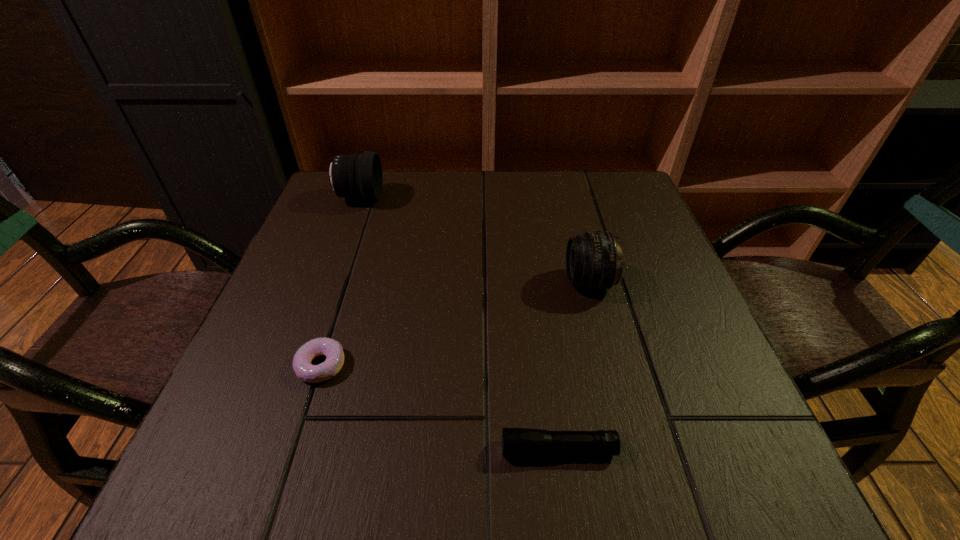
Where is `free region located at the front element of the right telephoto lens`? free region located at the front element of the right telephoto lens is located at coordinates (488, 282).

Locate an element on the screen. This screenshot has height=540, width=960. free spot located 0.090m at the front element of the right telephoto lens is located at coordinates click(x=522, y=282).

Locate an element on the screen. vacant space situated 0.090m at the lens end of the flashlight is located at coordinates (441, 449).

Where is `vacant space located 0.160m at the lens end of the flashlight`? vacant space located 0.160m at the lens end of the flashlight is located at coordinates (392, 449).

Locate an element on the screen. vacant position located 0.120m at the lens end of the flashlight is located at coordinates (420, 449).

You are a GUI agent. You are given a task and a screenshot of the screen. Output one action in this format:
    pyautogui.click(x=<x>, y=<y>)
    Task: Click on the vacant space located 0.380m on the right of the second nearest object
    
    Given the screenshot: What is the action you would take?
    pyautogui.click(x=570, y=365)

This screenshot has width=960, height=540. Find the location of `object that is at the far edge`. object that is at the far edge is located at coordinates (360, 176).

Locate an element on the screen. The width and height of the screenshot is (960, 540). object present at the near edge is located at coordinates (516, 442).

Find the location of a particular element. The image size is (960, 540). telephoto lens that is at the left edge is located at coordinates (360, 176).

Identify the location of doughnut present at the left edge. (332, 349).